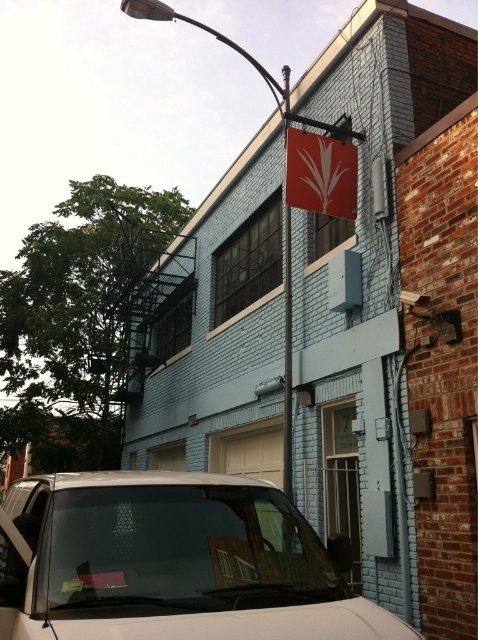
Question: Among these objects, which one is farthest from the camera?

Choices:
 (A) white matte car at lower left
 (B) red matte sign at upper center

Answer: (B)

Question: Is white matte car at lower left bigger than red matte sign at upper center?

Choices:
 (A) no
 (B) yes

Answer: (B)

Question: Does white matte car at lower left lie in front of red matte sign at upper center?

Choices:
 (A) yes
 (B) no

Answer: (A)

Question: Which of the following is the closest to the observer?

Choices:
 (A) (344, 196)
 (B) (212, 547)

Answer: (B)

Question: Is white matte car at lower left further to the viewer compared to red matte sign at upper center?

Choices:
 (A) no
 (B) yes

Answer: (A)